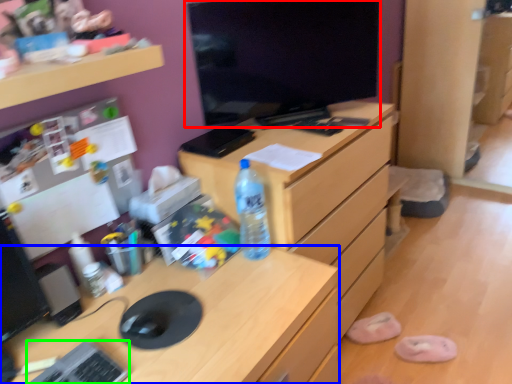
Question: Which object is positioned closest to computer monitor (highlighted by a red box)? Select from desk (highlighted by a blue box) and keyboard (highlighted by a green box).

Choices:
 (A) desk
 (B) keyboard

Answer: (A)